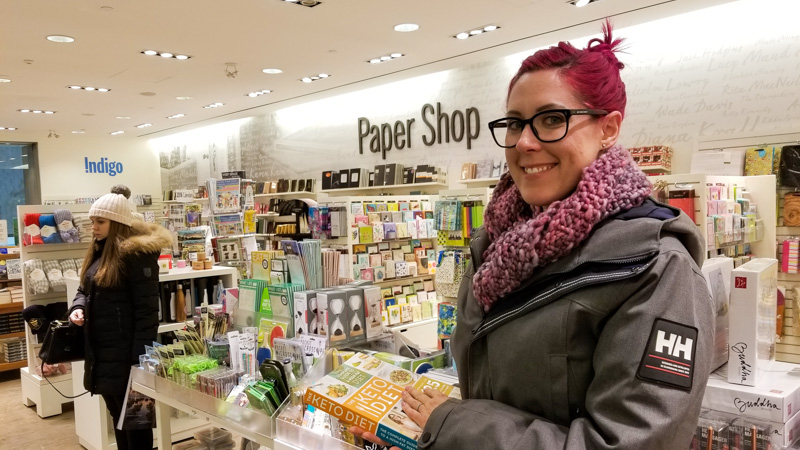
Locate an element on the screen. floor is located at coordinates (18, 425).